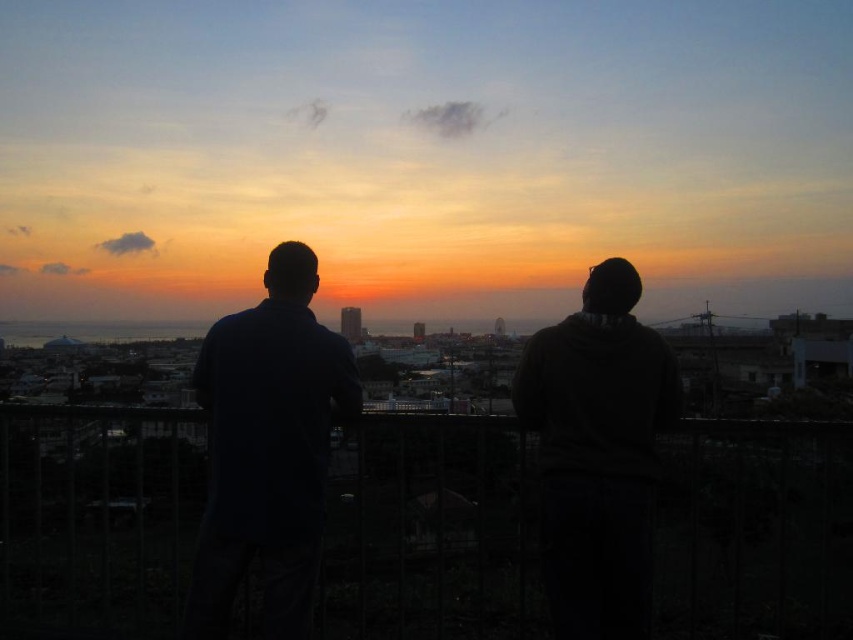
Question: Which point is farther to the camera?

Choices:
 (A) dark blue shirt at left
 (B) silhouette clothing at center
 (C) dark gray hoodie at center

Answer: (C)

Question: Is silhouette clothing at center smaller than dark blue shirt at left?

Choices:
 (A) no
 (B) yes

Answer: (A)

Question: Considering the relative positions of dark blue shirt at left and dark gray hoodie at center in the image provided, where is dark blue shirt at left located with respect to dark gray hoodie at center?

Choices:
 (A) left
 (B) right

Answer: (A)

Question: Which of the following is the closest to the observer?

Choices:
 (A) dark gray hoodie at center
 (B) dark blue shirt at left
 (C) silhouette clothing at center

Answer: (B)

Question: Estimate the real-world distances between objects in this image. Which object is farther from the silhouette clothing at center?

Choices:
 (A) dark blue shirt at left
 (B) dark gray hoodie at center

Answer: (B)

Question: Is silhouette clothing at center in front of dark gray hoodie at center?

Choices:
 (A) no
 (B) yes

Answer: (B)